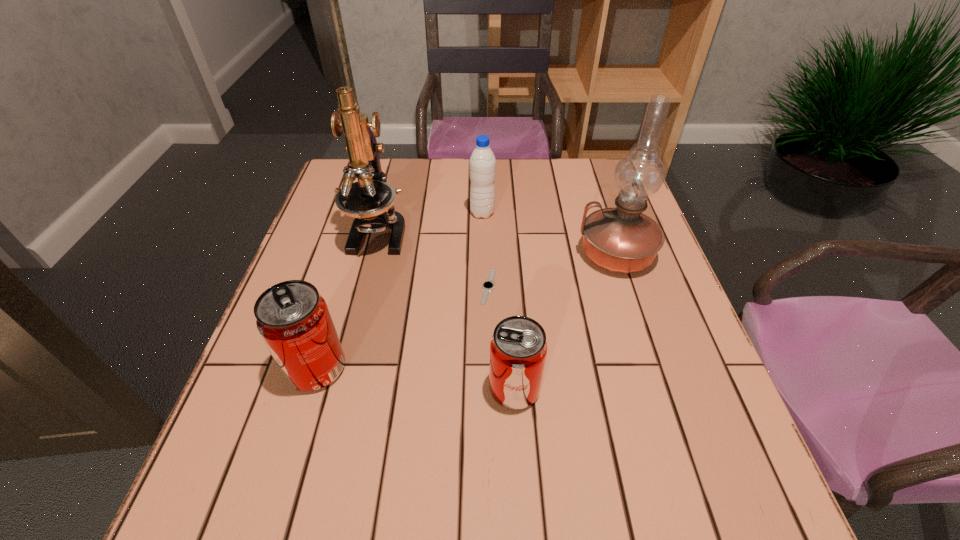
Image resolution: width=960 pixels, height=540 pixels. I want to click on the left pop soda, so click(x=293, y=319).

In order to click on the taller pop soda in this screenshot , I will do `click(293, 319)`.

Identify the location of the shorter pop soda. The height and width of the screenshot is (540, 960). (518, 348).

I want to click on the right pop soda, so click(518, 348).

Identify the location of water bottle. (482, 161).

The width and height of the screenshot is (960, 540). I want to click on the rightmost object, so click(623, 240).

Locate an element on the screen. microscope is located at coordinates (370, 201).

The height and width of the screenshot is (540, 960). I want to click on watch, so click(x=488, y=285).

Where is `free space located on the front of the fourth tallest object`? This screenshot has height=540, width=960. free space located on the front of the fourth tallest object is located at coordinates (298, 430).

In order to click on blank area located on the front of the right pop soda in this screenshot , I will do `click(518, 450)`.